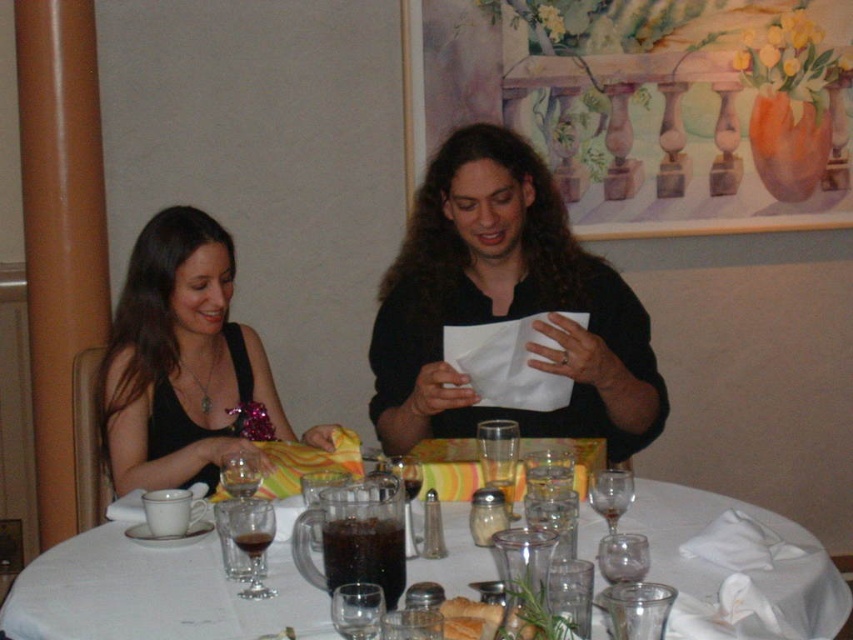
You are sitting at the round table in the restaurant scene. You want to place a small vase on the surface that is closer to you. Which object should you choose between the translucent glass table at center and the transparent glass at center?

You should place the vase on the translucent glass table at center because it is closer to you than the transparent glass at center.

You are a waiter in a restaurant and need to place a large dessert plate on the table. Which object, the translucent glass table at center or the transparent glass at center, should you avoid placing the plate on to ensure there is enough space?

You should avoid placing the plate on the transparent glass at center because the translucent glass table at center is bigger and can accommodate the large dessert plate, while the transparent glass at center is smaller and may not have enough space.

You are a photographer setting up a shoot in this dining area. You need to position a small light source between the black matte dress at left and the transparent glass wine glass at table center. Given their heights, which object should the light be placed closer to?

The black matte dress at left is much taller than the transparent glass wine glass at table center, so the light should be placed closer to the transparent glass wine glass at table center to ensure proper illumination.